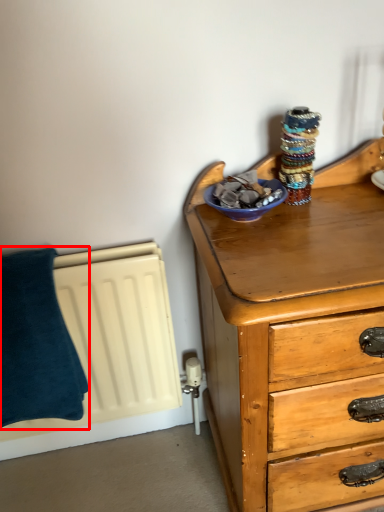
Question: From the image's perspective, where is pillow (annotated by the red box) located in relation to glass bowl in the image?

Choices:
 (A) below
 (B) above

Answer: (A)